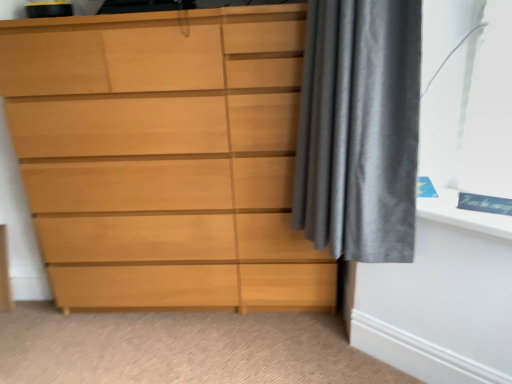
The height and width of the screenshot is (384, 512). What do you see at coordinates (359, 129) in the screenshot?
I see `satin gray curtain at right` at bounding box center [359, 129].

Locate an element on the screen. satin gray curtain at right is located at coordinates [x=359, y=129].

At what (x,y) coordinates should I click in order to perform the action: click on light wood chest of drawers at left. Please return your answer as a coordinate pair (x, y). The width and height of the screenshot is (512, 384). Looking at the image, I should click on (164, 158).

What do you see at coordinates (164, 158) in the screenshot? The image size is (512, 384). I see `light wood chest of drawers at left` at bounding box center [164, 158].

I want to click on satin gray curtain at right, so click(x=359, y=129).

Which object is positioned more to the right, satin gray curtain at right or light wood chest of drawers at left?

From the viewer's perspective, satin gray curtain at right appears more on the right side.

Does satin gray curtain at right come in front of light wood chest of drawers at left?

Yes, satin gray curtain at right is in front of light wood chest of drawers at left.

Is point (321, 209) closer to viewer compared to point (122, 215)?

That is True.

From the image's perspective, is satin gray curtain at right below light wood chest of drawers at left?

Actually, satin gray curtain at right appears above light wood chest of drawers at left in the image.

From a real-world perspective, is satin gray curtain at right on light wood chest of drawers at left?

Yes, from a real-world perspective, satin gray curtain at right is over light wood chest of drawers at left

Can you confirm if satin gray curtain at right is wider than light wood chest of drawers at left?

In fact, satin gray curtain at right might be narrower than light wood chest of drawers at left.

Is satin gray curtain at right shorter than light wood chest of drawers at left?

Yes.

Considering the sizes of objects satin gray curtain at right and light wood chest of drawers at left in the image provided, who is bigger, satin gray curtain at right or light wood chest of drawers at left?

Bigger between the two is light wood chest of drawers at left.

Is satin gray curtain at right not within light wood chest of drawers at left?

Yes, satin gray curtain at right is outside of light wood chest of drawers at left.

Is satin gray curtain at right beside light wood chest of drawers at left?

No, satin gray curtain at right is not in contact with light wood chest of drawers at left.

Could you tell me if satin gray curtain at right is facing light wood chest of drawers at left?

No, satin gray curtain at right is not facing towards light wood chest of drawers at left.

Locate an element on the screen. Image resolution: width=512 pixels, height=384 pixels. the chest of drawers located below the satin gray curtain at right (from the image's perspective) is located at coordinates (164, 158).

Would you say light wood chest of drawers at left is to the left or to the right of satin gray curtain at right in the picture?

light wood chest of drawers at left is to the left of satin gray curtain at right.

Considering their positions, is light wood chest of drawers at left located in front of or behind satin gray curtain at right?

light wood chest of drawers at left is behind satin gray curtain at right.

Considering the positions of points (221, 222) and (412, 200), is point (221, 222) farther from camera compared to point (412, 200)?

Yes, point (221, 222) is behind point (412, 200).

From the image's perspective, is light wood chest of drawers at left under satin gray curtain at right?

Correct, light wood chest of drawers at left appears lower than satin gray curtain at right in the image.

From a real-world perspective, is light wood chest of drawers at left physically located above or below satin gray curtain at right?

light wood chest of drawers at left is below satin gray curtain at right.

Which of these two, light wood chest of drawers at left or satin gray curtain at right, is thinner?

Thinner between the two is satin gray curtain at right.

Considering the relative sizes of light wood chest of drawers at left and satin gray curtain at right in the image provided, is light wood chest of drawers at left taller than satin gray curtain at right?

Yes, light wood chest of drawers at left is taller than satin gray curtain at right.

In terms of size, does light wood chest of drawers at left appear bigger or smaller than satin gray curtain at right?

Clearly, light wood chest of drawers at left is larger in size than satin gray curtain at right.

Would you say light wood chest of drawers at left is inside or outside satin gray curtain at right?

light wood chest of drawers at left is located beyond the bounds of satin gray curtain at right.

Is light wood chest of drawers at left not close to satin gray curtain at right?

No, light wood chest of drawers at left is not far from satin gray curtain at right.

Is light wood chest of drawers at left looking in the opposite direction of satin gray curtain at right?

No.

How different are the orientations of light wood chest of drawers at left and satin gray curtain at right in degrees?

The facing directions of light wood chest of drawers at left and satin gray curtain at right are 86.2 degrees apart.

Identify the location of chest of drawers below the satin gray curtain at right (from a real-world perspective). The width and height of the screenshot is (512, 384). (164, 158).

Where is `chest of drawers on the left of satin gray curtain at right`? The width and height of the screenshot is (512, 384). chest of drawers on the left of satin gray curtain at right is located at coordinates coord(164,158).

The height and width of the screenshot is (384, 512). Find the location of `curtain located above the light wood chest of drawers at left (from a real-world perspective)`. curtain located above the light wood chest of drawers at left (from a real-world perspective) is located at coordinates (359, 129).